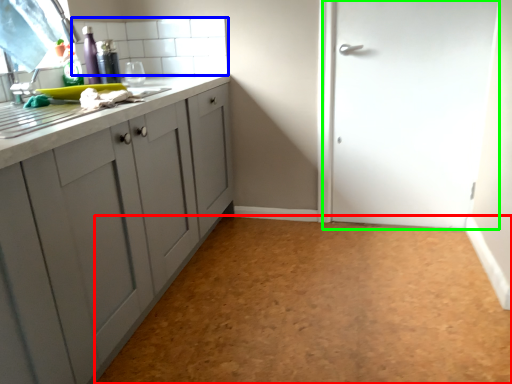
Question: Which is nearer to the plain (highlighted by a red box)? tile (highlighted by a blue box) or door (highlighted by a green box).

Choices:
 (A) tile
 (B) door

Answer: (B)